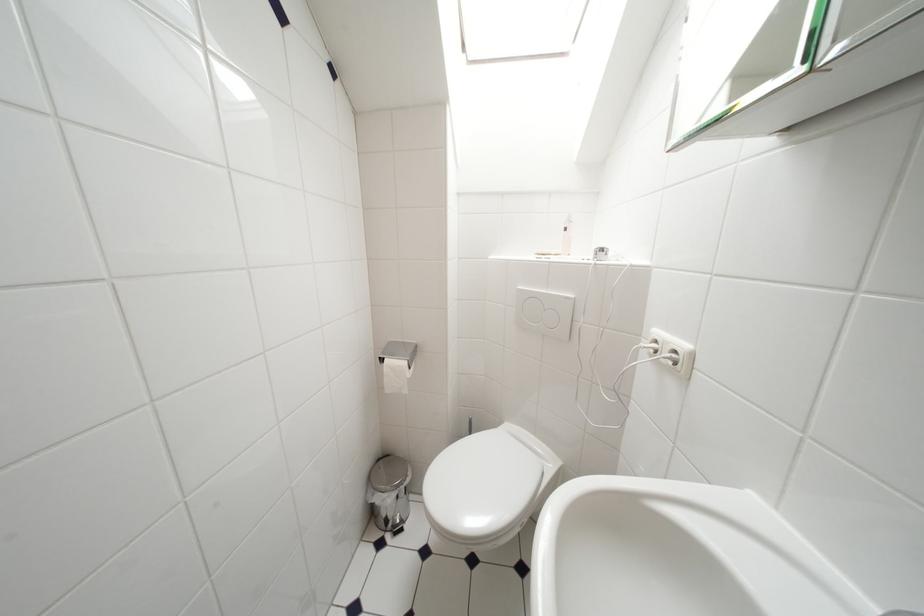
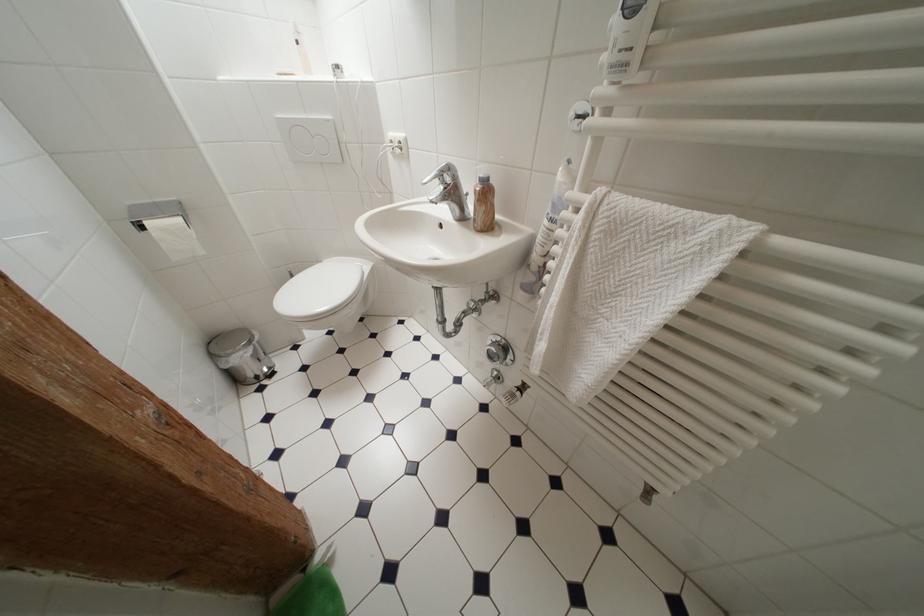
In the second image, find the point that corresponds to point 506,428 in the first image.

(325, 265)